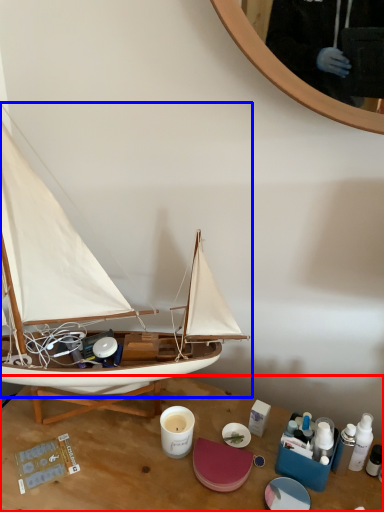
Question: Which object is further to the camera taking this photo, desk (highlighted by a red box) or boat (highlighted by a blue box)?

Choices:
 (A) desk
 (B) boat

Answer: (A)